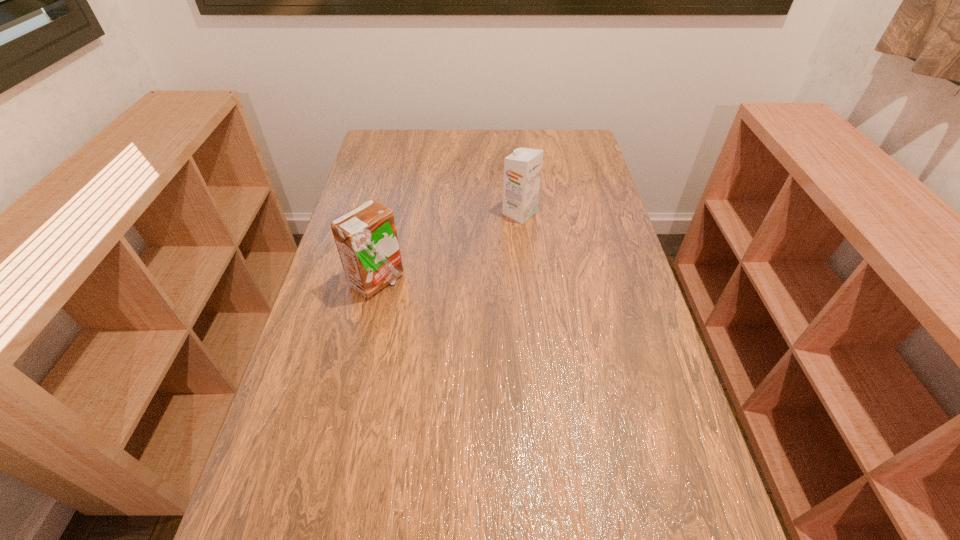
At what (x,y) coordinates should I click in order to perform the action: click on the farther carton. Please return your answer as a coordinate pair (x, y). The height and width of the screenshot is (540, 960). Looking at the image, I should click on (522, 169).

Where is `the right carton`? the right carton is located at coordinates (522, 169).

The width and height of the screenshot is (960, 540). Identify the location of the nearer carton. (366, 238).

Locate an element on the screen. The height and width of the screenshot is (540, 960). the nearer object is located at coordinates coord(366,238).

This screenshot has width=960, height=540. In order to click on free region located 0.360m on the front of the right carton in this screenshot , I will do pos(530,316).

Image resolution: width=960 pixels, height=540 pixels. In order to click on vacant space located on the straw side of the left carton in this screenshot , I will do `click(451, 281)`.

This screenshot has height=540, width=960. Find the location of `object that is at the left edge`. object that is at the left edge is located at coordinates (366, 238).

Locate an element on the screen. The image size is (960, 540). blank space at the far edge of the desktop is located at coordinates (535, 148).

In order to click on vacant space at the left edge of the desktop in this screenshot , I will do `click(253, 525)`.

Locate an element on the screen. This screenshot has height=540, width=960. vacant space at the right edge is located at coordinates (578, 173).